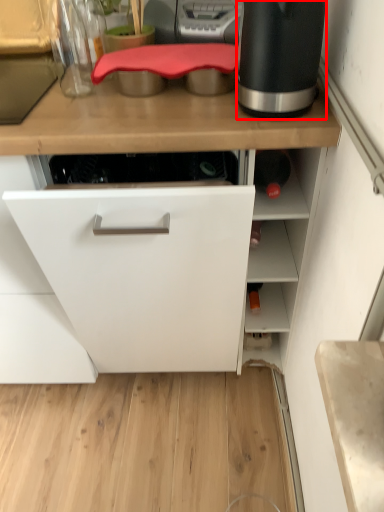
Question: Where is home appliance (annotated by the red box) located in relation to kitchen appliance in the image?

Choices:
 (A) right
 (B) left

Answer: (A)